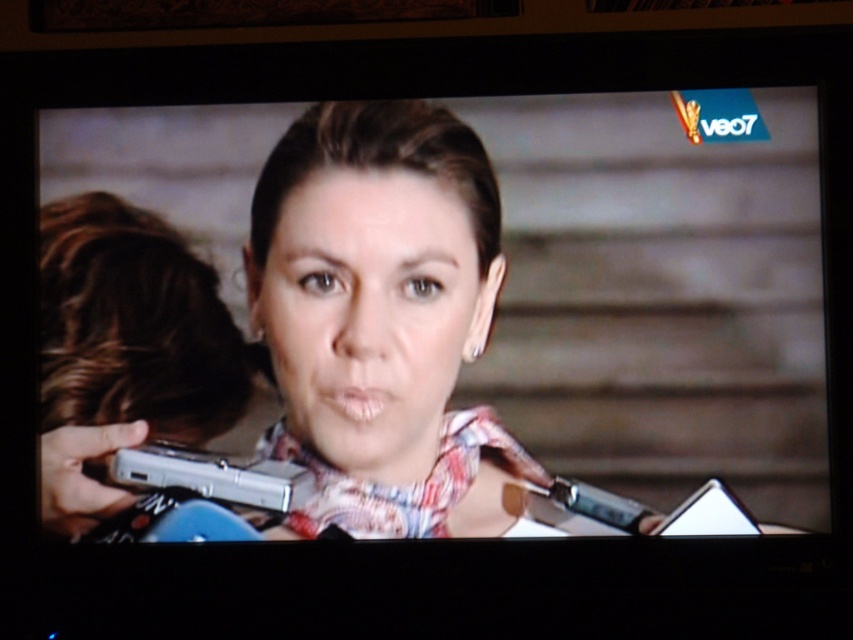
Question: Is matte pink scarf at center to the left of shiny silver phone at left from the viewer's perspective?

Choices:
 (A) no
 (B) yes

Answer: (A)

Question: Which point is closer to the camera taking this photo?

Choices:
 (A) (285, 202)
 (B) (299, 376)
 (C) (119, 282)

Answer: (C)

Question: Is matte skin face at center positioned in front of shiny silver phone at left?

Choices:
 (A) no
 (B) yes

Answer: (B)

Question: Is matte pink scarf at center bigger than shiny silver phone at left?

Choices:
 (A) yes
 (B) no

Answer: (A)

Question: Among these points, which one is farthest from the camera?

Choices:
 (A) (123, 500)
 (B) (393, 170)
 (C) (392, 288)

Answer: (B)

Question: Considering the real-world distances, which object is closest to the matte pink scarf at center?

Choices:
 (A) matte skin face at center
 (B) shiny silver phone at left

Answer: (A)